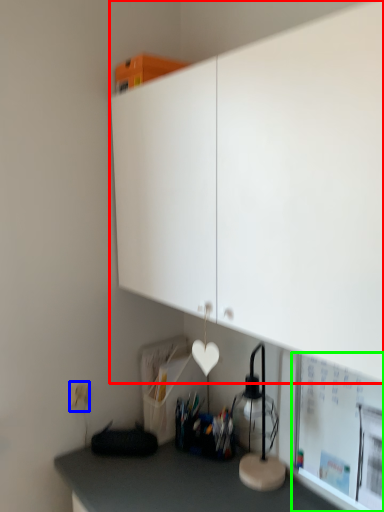
Question: Estimate the real-world distances between objects in this image. Which object is farther from cabinetry (highlighted by a red box), electric outlet (highlighted by a blue box) or bulletin board (highlighted by a green box)?

Choices:
 (A) electric outlet
 (B) bulletin board

Answer: (A)